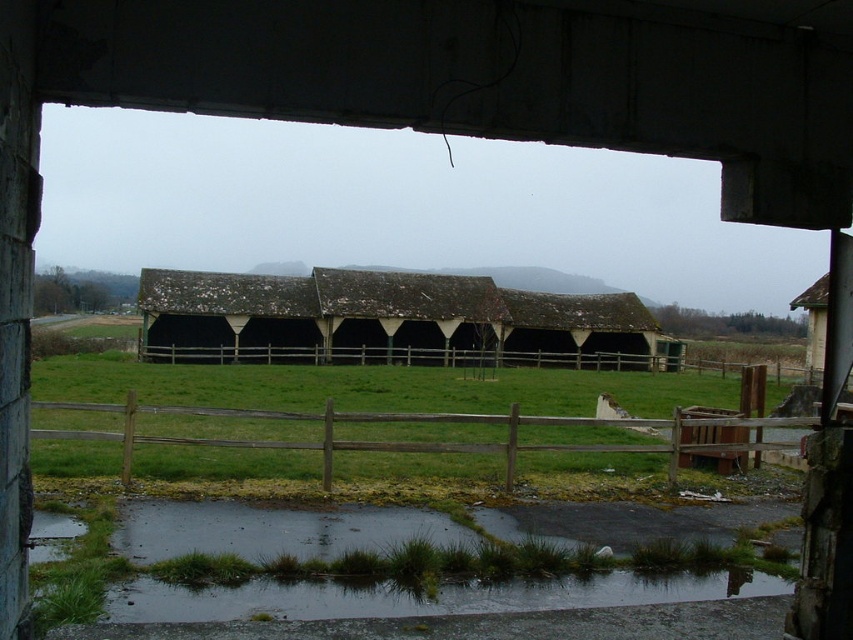
Question: Which point is farther from the camera taking this photo?

Choices:
 (A) (273, 316)
 (B) (726, 417)

Answer: (A)

Question: Considering the relative positions of wooden fence at center and brown wooden fence at center in the image provided, where is wooden fence at center located with respect to brown wooden fence at center?

Choices:
 (A) above
 (B) below

Answer: (A)

Question: Which point appears farthest from the camera in this image?

Choices:
 (A) (514, 483)
 (B) (643, 356)

Answer: (B)

Question: Can you confirm if rusty metal barn at center is bigger than wooden fence at center?

Choices:
 (A) yes
 (B) no

Answer: (A)

Question: Which point appears farthest from the camera in this image?

Choices:
 (A) (552, 356)
 (B) (303, 356)

Answer: (A)

Question: Can you confirm if rusty metal barn at center is thinner than wooden fence at center?

Choices:
 (A) no
 (B) yes

Answer: (A)